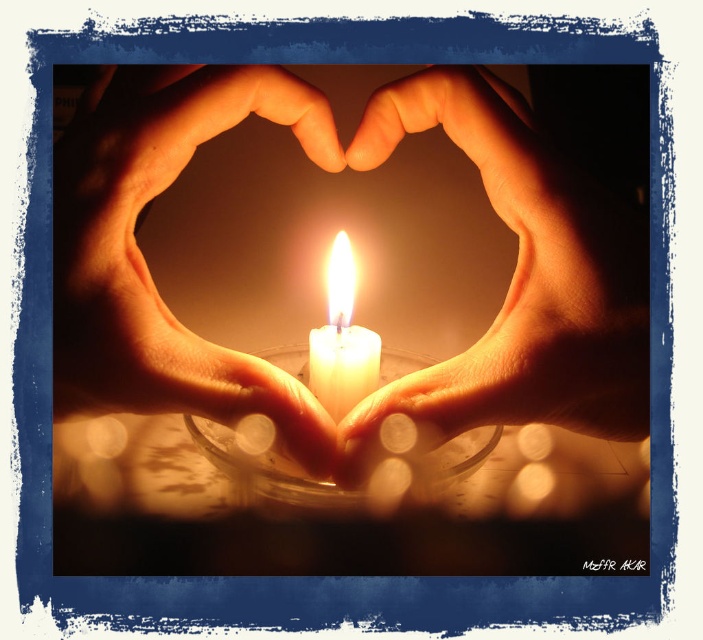
This screenshot has width=703, height=640. Identify the location of matte skin hand at center. (520, 280).

Which is in front, point (508, 109) or point (373, 388)?

Point (508, 109)

The image size is (703, 640). What do you see at coordinates (520, 280) in the screenshot?
I see `matte skin hand at center` at bounding box center [520, 280].

Where is `matte skin hand at center`? matte skin hand at center is located at coordinates (520, 280).

Which of these two, matte skin hands at center or white wax candle at center, stands shorter?

white wax candle at center

Who is more forward, (x=109, y=90) or (x=349, y=401)?

Positioned in front is point (x=109, y=90).

Is point (273, 67) farther from viewer compared to point (333, 371)?

That is True.

In order to click on matte skin hands at center in this screenshot , I will do `click(143, 257)`.

Is matte skin hand at center bigger than matte skin hands at center?

No.

Who is positioned more to the left, matte skin hand at center or matte skin hands at center?

Positioned to the left is matte skin hands at center.

Based on the photo, measure the distance between matte skin hand at center and camera.

matte skin hand at center is 19.29 centimeters from camera.

Find the location of a particular element. matte skin hand at center is located at coordinates (520, 280).